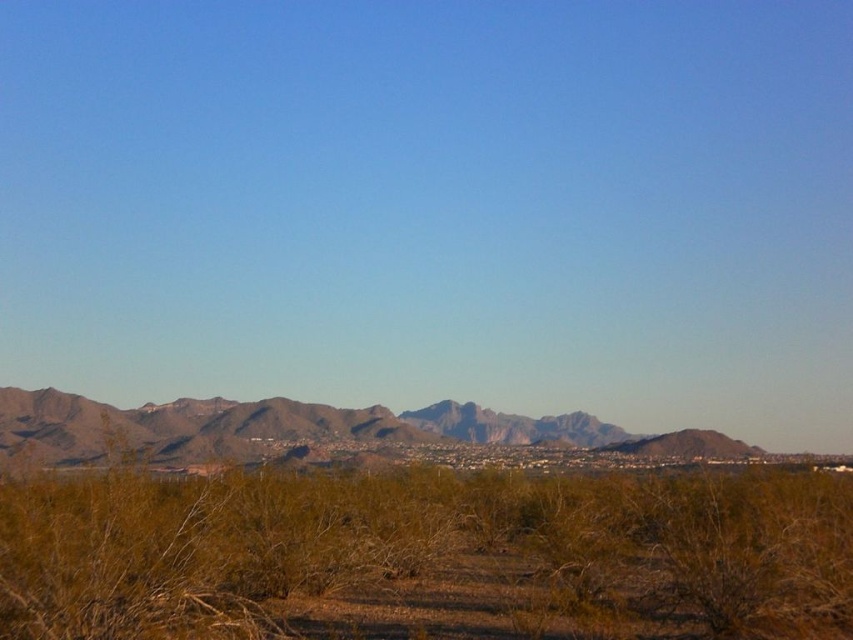
You are a hiker planning to cross the desert and need to determine which object is closer to you. Based on the scene, which one is lower in height between the brown shrubbery at center and the brown rocky mountains at center?

The brown shrubbery at center is shorter than the brown rocky mountains at center, so the brown shrubbery at center is lower in height and closer to you.